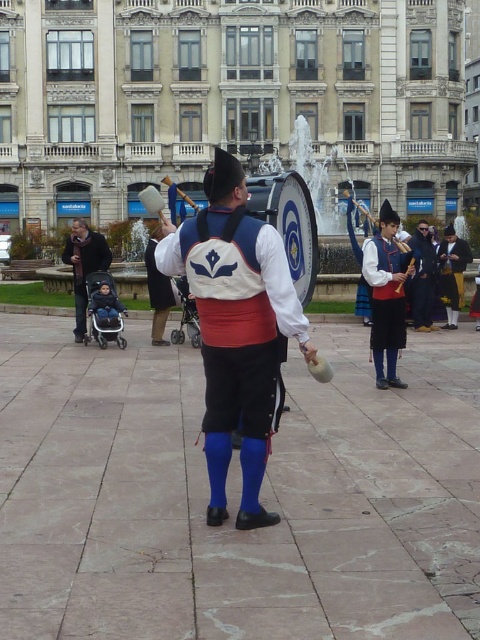
You are a photographer standing in the square and want to take a photo that includes both the matte blue fabric drum at center and the dark blue fabric jacket at left. The minimum distance between the two objects in your camera frame must be at least 50 feet. Can you capture both in the same photo?

The matte blue fabric drum at center and dark blue fabric jacket at left are 48.99 feet apart from each other, which is less than the required 50 feet. Therefore, you cannot capture both in the same photo with the specified minimum distance.

You are a photographer standing in the square and want to take a photo of the matte blue fabric hat at right and the velvet brown vest at center. Which object should you focus on first to ensure both are in sharp focus?

You should focus on the matte blue fabric hat at right first since it is closer to the viewer than the velvet brown vest at center. By focusing on the closer object, the depth of field may also keep the farther object in focus.